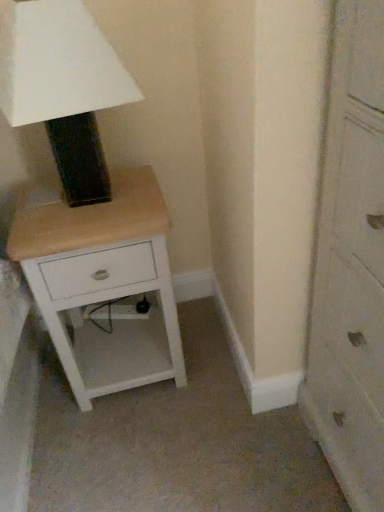
Question: Looking at the image, does wooden chest of drawers at right seem bigger or smaller compared to matte black lampshade at upper left?

Choices:
 (A) big
 (B) small

Answer: (A)

Question: Is wooden chest of drawers at right inside the boundaries of matte black lampshade at upper left, or outside?

Choices:
 (A) inside
 (B) outside

Answer: (B)

Question: Estimate the real-world distances between objects in this image. Which object is farther from the wooden chest of drawers at right?

Choices:
 (A) matte black lampshade at upper left
 (B) white wood nightstand at lower left

Answer: (A)

Question: Which object is positioned farthest from the wooden chest of drawers at right?

Choices:
 (A) white wood nightstand at lower left
 (B) matte black lampshade at upper left

Answer: (B)